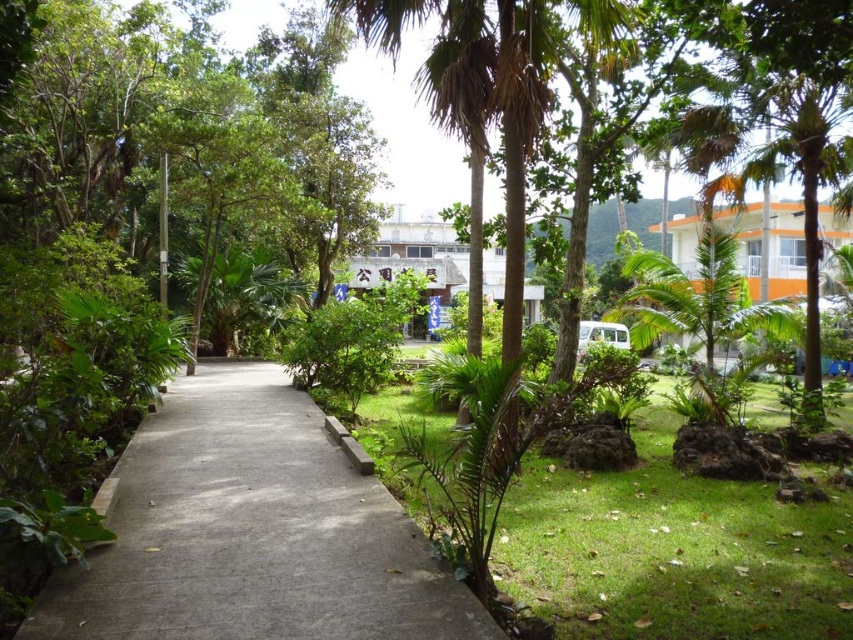
Question: Which of the following is the closest to the observer?

Choices:
 (A) green leafy palm tree at center-right
 (B) green grass at center
 (C) gray concrete pavement at center

Answer: (C)

Question: In this image, where is gray concrete pavement at center located relative to green leafy palm tree at center-right?

Choices:
 (A) right
 (B) left

Answer: (B)

Question: Is gray concrete pavement at center wider than green leafy palm tree at center?

Choices:
 (A) no
 (B) yes

Answer: (B)

Question: Among these points, which one is nearest to the camera?

Choices:
 (A) (804, 609)
 (B) (355, 572)
 (C) (729, 337)

Answer: (B)

Question: Which point is closer to the camera?

Choices:
 (A) green grass at center
 (B) green leafy palm tree at center-right
 (C) green leafy palm tree at center

Answer: (A)

Question: Can you confirm if gray concrete pavement at center is positioned above green leafy palm tree at center?

Choices:
 (A) yes
 (B) no

Answer: (B)